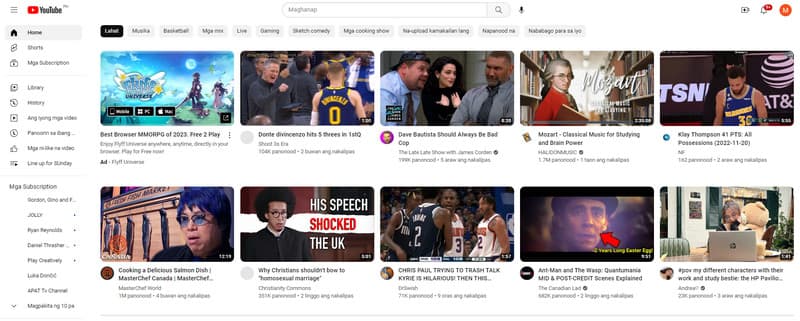
Where is `laptop`? The width and height of the screenshot is (800, 321). laptop is located at coordinates (732, 226).